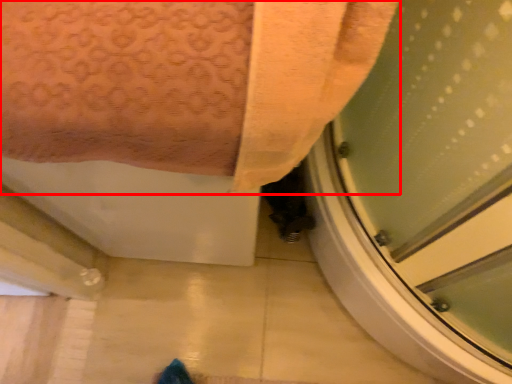
Question: In this image, where is towel (annotated by the red box) located relative to screen door?

Choices:
 (A) left
 (B) right

Answer: (A)